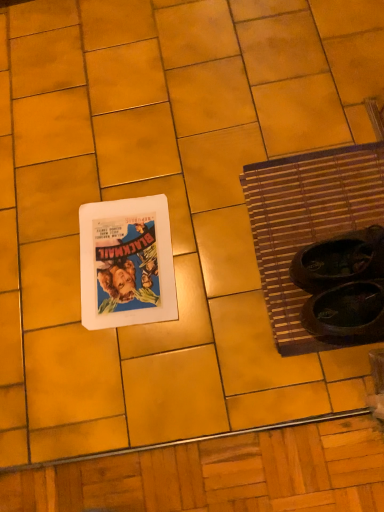
Question: Is brown woven mat at right bigger or smaller than white matte picture frame at center-left?

Choices:
 (A) small
 (B) big

Answer: (B)

Question: Relative to white matte picture frame at center-left, is brown woven mat at right in front or behind?

Choices:
 (A) front
 (B) behind

Answer: (A)

Question: From a real-world perspective, is brown woven mat at right positioned above or below white matte picture frame at center-left?

Choices:
 (A) below
 (B) above

Answer: (A)

Question: From a real-world perspective, is white matte picture frame at center-left above or below brown woven mat at right?

Choices:
 (A) above
 (B) below

Answer: (A)

Question: Is point (153, 224) closer or farther from the camera than point (334, 219)?

Choices:
 (A) closer
 (B) farther

Answer: (B)

Question: From the image's perspective, is white matte picture frame at center-left located above or below brown woven mat at right?

Choices:
 (A) below
 (B) above

Answer: (A)

Question: Considering the positions of white matte picture frame at center-left and brown woven mat at right in the image, is white matte picture frame at center-left bigger or smaller than brown woven mat at right?

Choices:
 (A) big
 (B) small

Answer: (B)